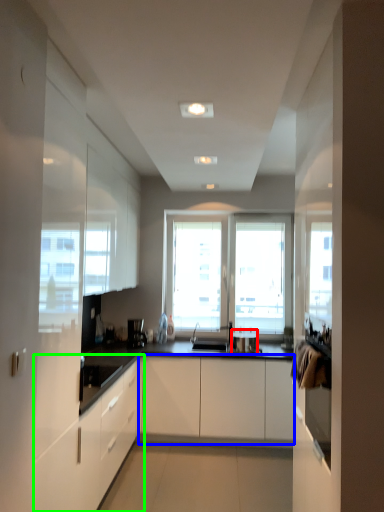
Question: Which is farther away from appliance (highlighted by a red box)? cabinetry (highlighted by a blue box) or cabinetry (highlighted by a green box)?

Choices:
 (A) cabinetry
 (B) cabinetry

Answer: (B)